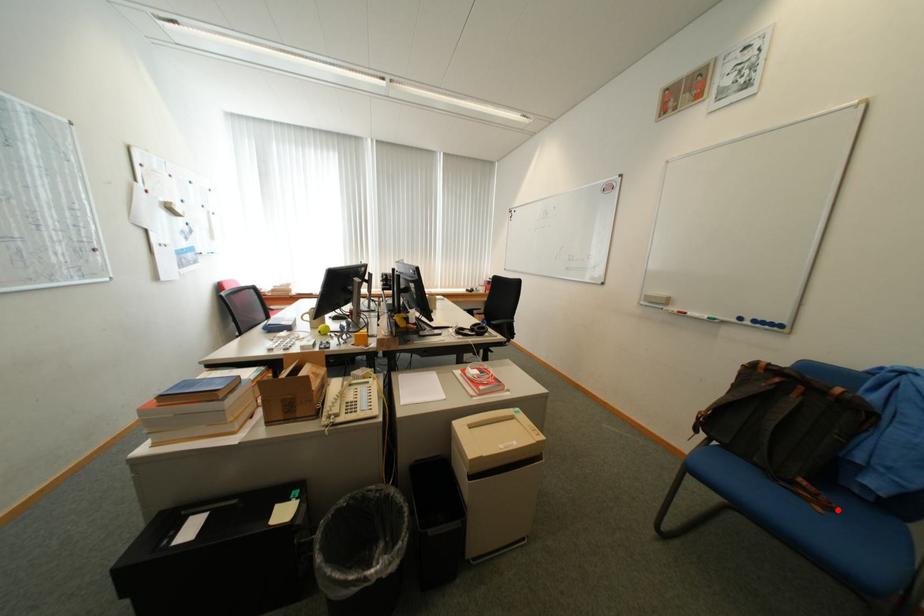
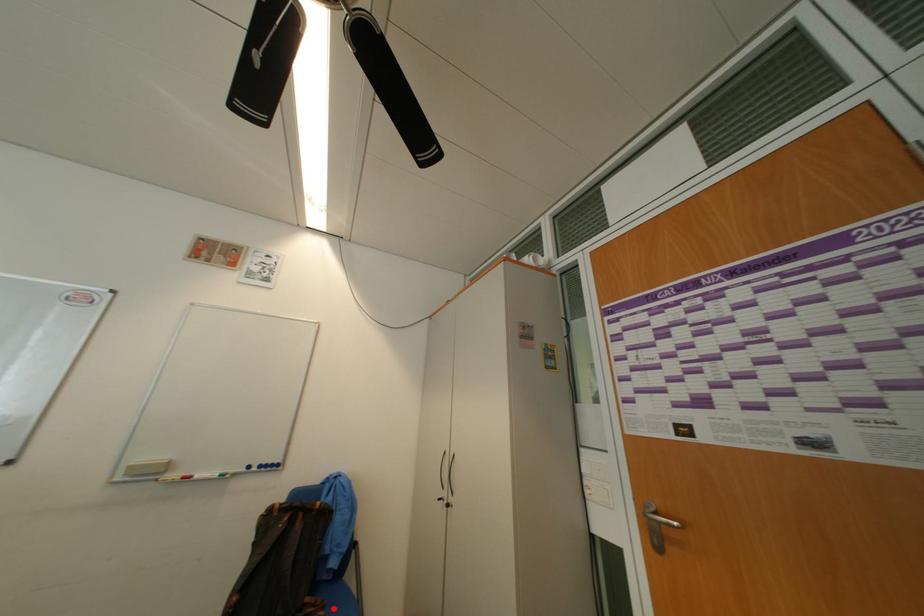
Looking at this image, I am providing you with two images of the same scene from different viewpoints. A red point is marked on the first image and another point is marked on the second image. Are the points marked in image1 and image2 representing the same 3D position?

Yes